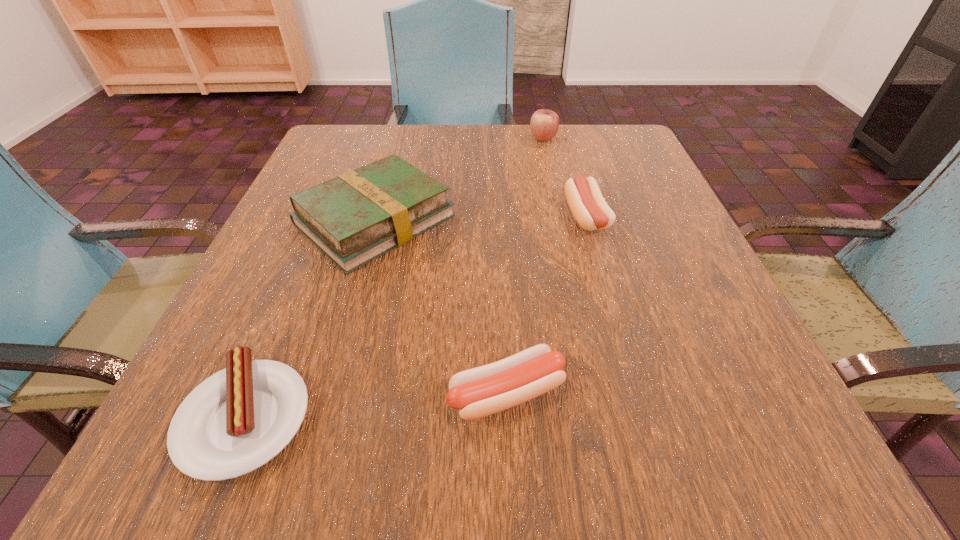
Identify the location of vacant space at the right edge of the desktop. Image resolution: width=960 pixels, height=540 pixels. (657, 205).

In the image, there is a desktop. At what (x,y) coordinates should I click in order to perform the action: click on vacant space at the far left corner. Please return your answer as a coordinate pair (x, y). Image resolution: width=960 pixels, height=540 pixels. Looking at the image, I should click on (320, 159).

Identify the location of free space at the far right corner. The width and height of the screenshot is (960, 540). (598, 124).

At what (x,y) coordinates should I click in order to perform the action: click on free space at the near right corner of the desktop. Please return your answer as a coordinate pair (x, y). Looking at the image, I should click on (705, 461).

Locate an element on the screen. The width and height of the screenshot is (960, 540). vacant space that is in between the farthest sausage and the third object from left to right is located at coordinates (546, 306).

Locate an element on the screen. The width and height of the screenshot is (960, 540). vacant point located between the farthest object and the shortest object is located at coordinates (395, 278).

The image size is (960, 540). Find the location of `vacant space in between the third object from left to right and the book`. vacant space in between the third object from left to right and the book is located at coordinates (441, 307).

Where is `free space between the apple and the second tallest object`? free space between the apple and the second tallest object is located at coordinates (459, 179).

The height and width of the screenshot is (540, 960). I want to click on vacant area between the book and the third object from right to left, so click(441, 307).

Locate an element on the screen. free area in between the book and the rightmost sausage is located at coordinates (481, 219).